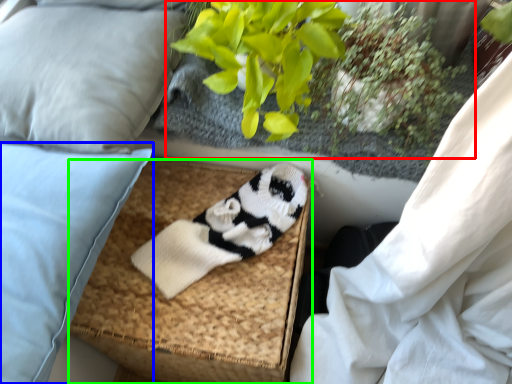
Question: Which is farther away from floral arrangement (highlighted by a red box)? pillow (highlighted by a blue box) or footrest (highlighted by a green box)?

Choices:
 (A) pillow
 (B) footrest

Answer: (A)